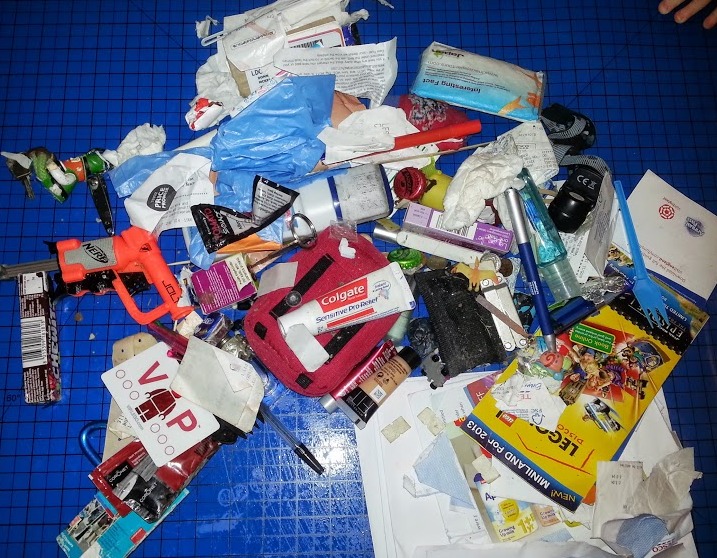
You are a GUI agent. You are given a task and a screenshot of the screen. Output one action in this format:
    pyautogui.click(x=<x>, y=<y>)
    Task: Click on the makeup
    Image resolution: width=717 pixels, height=558 pixels.
    Given the screenshot: What is the action you would take?
    pyautogui.click(x=386, y=394), pyautogui.click(x=348, y=383), pyautogui.click(x=451, y=256)